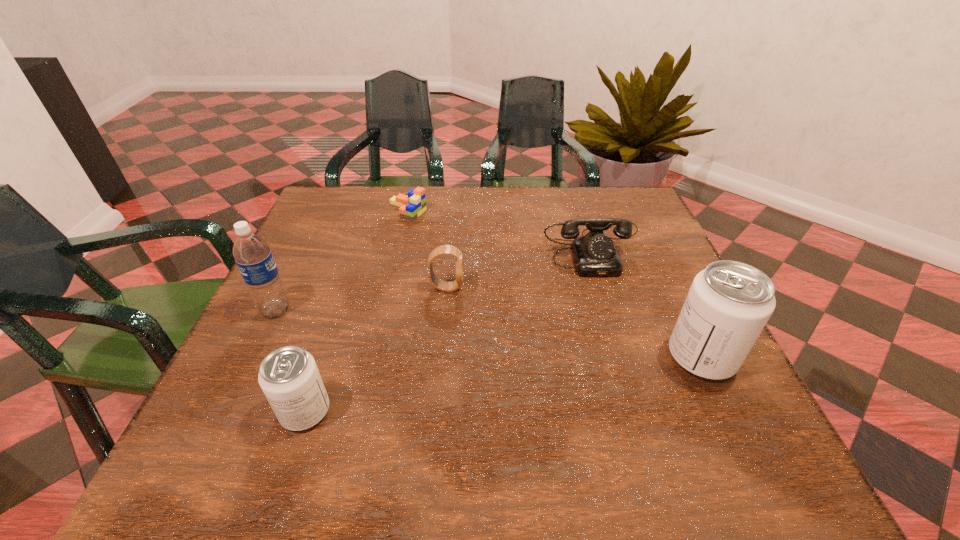
I want to click on water bottle located at the left edge, so click(251, 252).

Image resolution: width=960 pixels, height=540 pixels. Identify the location of soda can that is positioned at the right edge. (729, 303).

Image resolution: width=960 pixels, height=540 pixels. What are the coordinates of `telephone that is at the right edge` in the screenshot? It's located at (595, 255).

Identify the location of object present at the near left corner. The image size is (960, 540). (289, 377).

Where is `object that is at the far right corner`? object that is at the far right corner is located at coordinates (595, 255).

You are a GUI agent. You are given a task and a screenshot of the screen. Output one action in this format:
    pyautogui.click(x=<x>, y=<y>)
    Task: Click on the object that is positioned at the near right corner
    This screenshot has height=540, width=960.
    Given the screenshot: What is the action you would take?
    pyautogui.click(x=729, y=303)

This screenshot has width=960, height=540. Identify the location of vacant space at the far edge. (480, 220).

Where is `vacant area at the near edge of the desktop`? vacant area at the near edge of the desktop is located at coordinates (489, 411).

Find the location of a particular element. The image size is (960, 540). vacant space at the left edge is located at coordinates (306, 251).

In the image, there is a desktop. Where is `free space at the right edge`? The height and width of the screenshot is (540, 960). free space at the right edge is located at coordinates (660, 282).